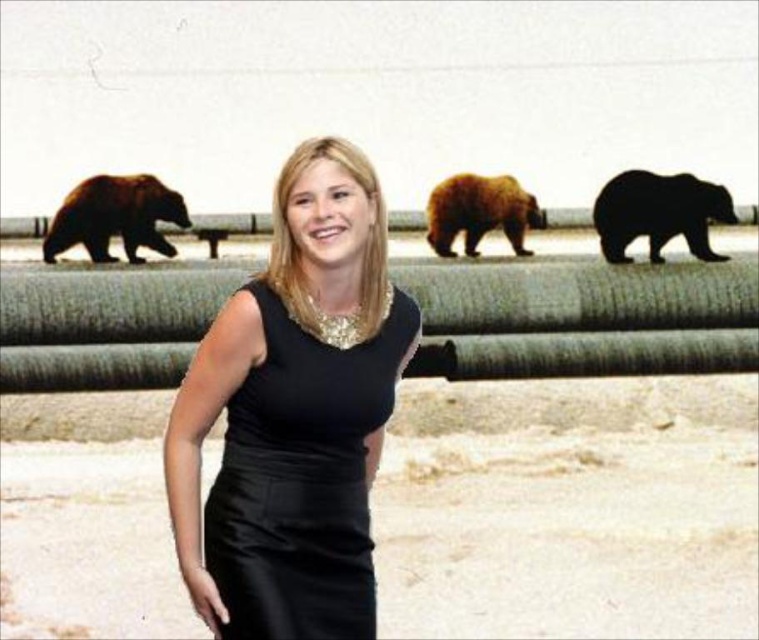
Between black fur bear at upper center and brown furry bear at left, which one appears on the left side from the viewer's perspective?

From the viewer's perspective, brown furry bear at left appears more on the left side.

Is point (690, 221) less distant than point (63, 234)?

Yes.

Who is more forward, (x=657, y=202) or (x=120, y=236)?

Point (x=657, y=202)

What are the coordinates of `black fur bear at upper center` in the screenshot? It's located at (657, 212).

Locate an element on the screen. The width and height of the screenshot is (759, 640). brown furry bear at left is located at coordinates click(115, 218).

Who is more distant from viewer, (x=219, y=532) or (x=168, y=211)?

The point (x=168, y=211) is more distant.

Which is in front, point (295, 531) or point (124, 180)?

Point (295, 531) is in front.

Where is `black satin dress at center`? This screenshot has width=759, height=640. black satin dress at center is located at coordinates (301, 477).